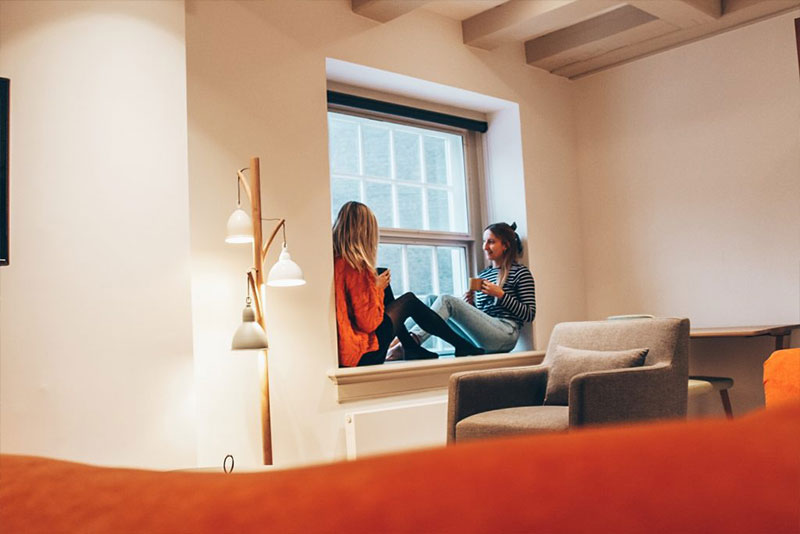
Locate an element on the screen. ceiling beams is located at coordinates (394, 7), (526, 20), (638, 34), (704, 20), (738, 18).